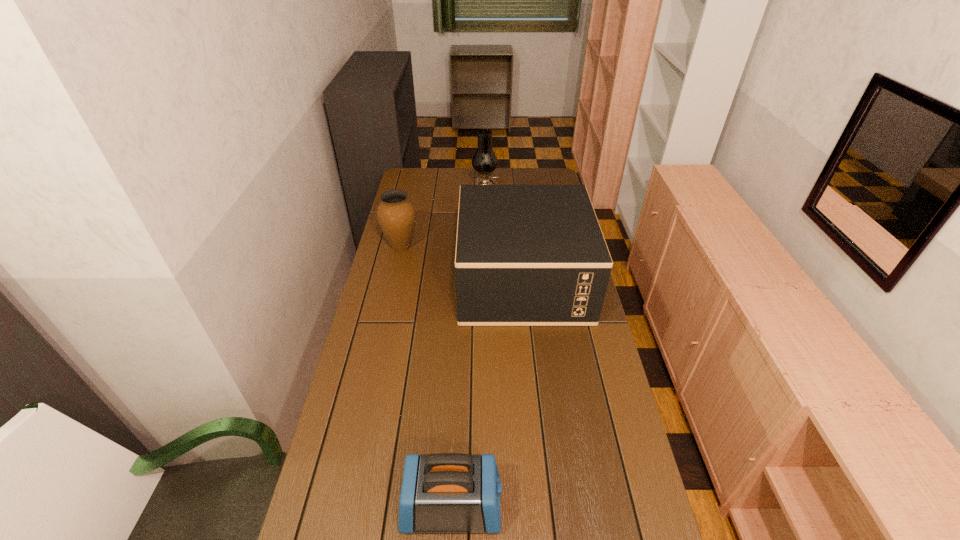
The width and height of the screenshot is (960, 540). I want to click on object that is the nearest to the nearest object, so click(x=526, y=255).